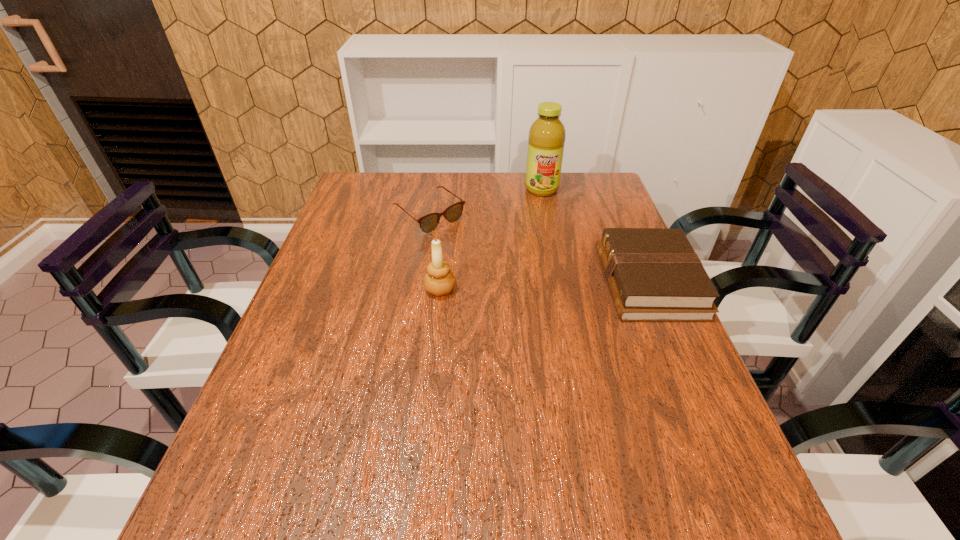
Find the location of a particular element. The width and height of the screenshot is (960, 540). vacant area that lies between the rightmost object and the candle_holder is located at coordinates (544, 286).

This screenshot has height=540, width=960. I want to click on empty location between the candle_holder and the Bible, so click(x=544, y=286).

Identify the location of vacant space in between the fruit juice and the candle_holder. coord(491,239).

Image resolution: width=960 pixels, height=540 pixels. I want to click on blank region between the shortest object and the third object from left to right, so click(486, 202).

You are a GUI agent. You are given a task and a screenshot of the screen. Output one action in this format:
    pyautogui.click(x=<x>, y=<y>)
    Task: Click on the vacant region between the fruit juice and the second tallest object
    
    Given the screenshot: What is the action you would take?
    pyautogui.click(x=491, y=239)

Identify which object is the closest to the rightmost object. Please provide its 2D coordinates. Your answer should be formatted as a tuple, i.e. [(x, y)], where the tuple contains the x and y coordinates of a point satisfying the conditions above.

[(546, 139)]

You are a GUI agent. You are given a task and a screenshot of the screen. Output one action in this format:
    pyautogui.click(x=<x>, y=<y>)
    Task: Click on the closest object relative to the spectacles
    This screenshot has height=540, width=960.
    Given the screenshot: What is the action you would take?
    pyautogui.click(x=439, y=280)

You are a GUI agent. You are given a task and a screenshot of the screen. Output one action in this format:
    pyautogui.click(x=<x>, y=<y>)
    Task: Click on the free location that satisfies the following two spatial constraints: 1. on the front side of the Bible; 2. on the spine side of the tallest object
    
    Given the screenshot: What is the action you would take?
    pyautogui.click(x=561, y=282)

This screenshot has width=960, height=540. I want to click on vacant region that satisfies the following two spatial constraints: 1. on the front side of the shortest object; 2. on the spine side of the Bible, so click(x=420, y=282).